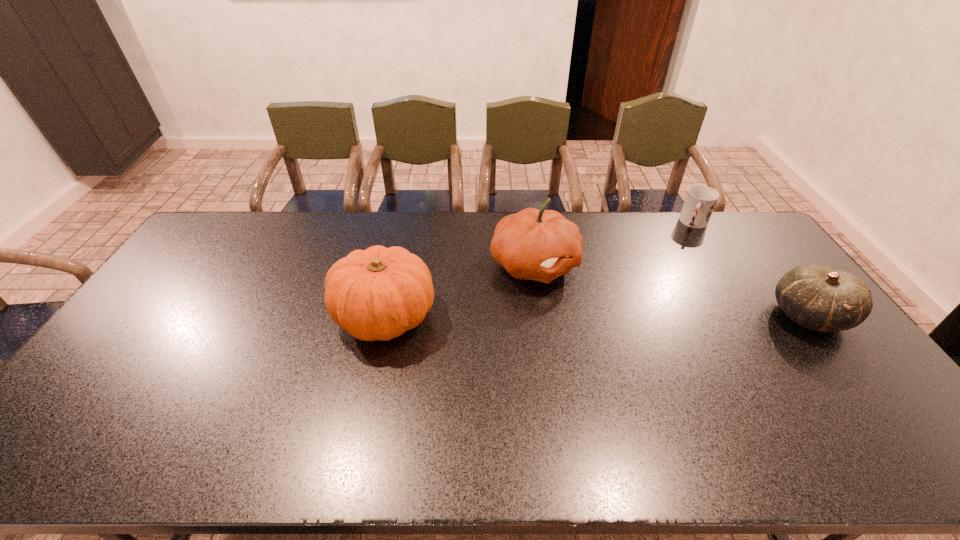
At what (x,y) coordinates should I click in order to perform the action: click on vacant space situated 0.130m on the front face of the right pumpkin. Please return your answer as a coordinate pair (x, y). Looking at the image, I should click on (614, 297).

I want to click on vacant space situated 0.080m on the handle side of the farthest object, so click(688, 244).

Locate an element on the screen. Image resolution: width=960 pixels, height=540 pixels. free point located 0.240m on the handle side of the farthest object is located at coordinates (679, 268).

You are a GUI agent. You are given a task and a screenshot of the screen. Output one action in this format:
    pyautogui.click(x=<x>, y=<y>)
    Task: Click on the free space located on the handle side of the farthest object
    
    Given the screenshot: What is the action you would take?
    pyautogui.click(x=690, y=239)

The width and height of the screenshot is (960, 540). Find the location of `pumpkin at the far edge`. pumpkin at the far edge is located at coordinates 541,245.

Where is `cup situated at the far edge`? The height and width of the screenshot is (540, 960). cup situated at the far edge is located at coordinates (700, 201).

You are a GUI agent. You are given a task and a screenshot of the screen. Output one action in this format:
    pyautogui.click(x=<x>, y=<y>)
    Task: Click on the gourd that is at the right edge
    The image size is (960, 540).
    Given the screenshot: What is the action you would take?
    pyautogui.click(x=819, y=298)

The width and height of the screenshot is (960, 540). What are the coordinates of `cup present at the right edge` in the screenshot? It's located at (700, 201).

This screenshot has width=960, height=540. In order to click on object situated at the far right corner in this screenshot , I will do `click(700, 201)`.

The height and width of the screenshot is (540, 960). Identify the location of vacant space at the far edge of the desktop. (568, 214).